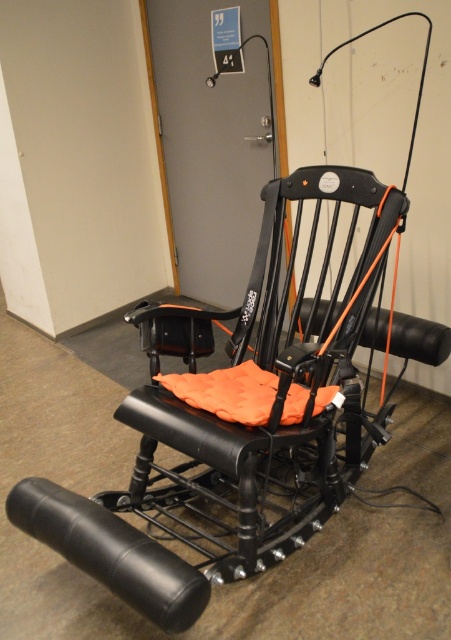
This screenshot has height=640, width=451. What are the coordinates of `black matte/leather chair at center` in the screenshot? It's located at (265, 390).

Is black matte/leather chair at center thinner than black leather armrest at lower left?

No, black matte/leather chair at center is not thinner than black leather armrest at lower left.

At what (x,y) coordinates should I click in order to perform the action: click on black matte/leather chair at center. Please return your answer as a coordinate pair (x, y). The image size is (451, 640). Looking at the image, I should click on (265, 390).